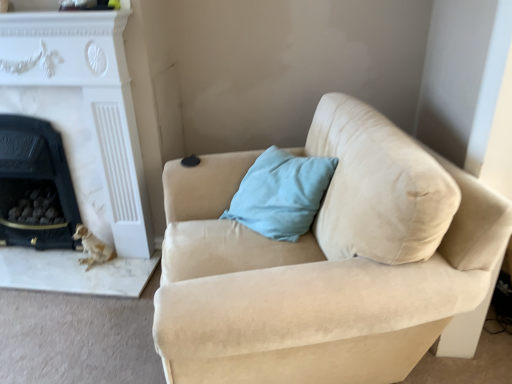
What do you see at coordinates (35, 186) in the screenshot? This screenshot has width=512, height=384. I see `black marble fireplace at left, the 2th fireplace viewed from the right` at bounding box center [35, 186].

This screenshot has height=384, width=512. I want to click on black marble fireplace at left, which appears as the 1th fireplace when viewed from the left, so click(35, 186).

From a real-world perspective, is white marble fireplace at left, marked as the second fireplace in a left-to-right arrangement, physically above beige suede couch at center?

Yes, from a real-world perspective, white marble fireplace at left, marked as the second fireplace in a left-to-right arrangement, is above beige suede couch at center.

Would you say beige suede couch at center is part of white marble fireplace at left, marked as the second fireplace in a left-to-right arrangement,'s contents?

No, beige suede couch at center is not a part of white marble fireplace at left, marked as the second fireplace in a left-to-right arrangement.

Between white marble fireplace at left, marked as the second fireplace in a left-to-right arrangement, and beige suede couch at center, which one has smaller size?

white marble fireplace at left, marked as the second fireplace in a left-to-right arrangement, is smaller.

How far apart are white marble fireplace at left, which is counted as the first fireplace, starting from the right, and beige suede couch at center?

white marble fireplace at left, which is counted as the first fireplace, starting from the right, is 34.21 inches away from beige suede couch at center.

Measure the distance between white marble fireplace at left, which is counted as the first fireplace, starting from the right, and light blue fabric pillow at upper right.

white marble fireplace at left, which is counted as the first fireplace, starting from the right, and light blue fabric pillow at upper right are 31.12 inches apart from each other.

This screenshot has width=512, height=384. In order to click on fireplace that appears above the light blue fabric pillow at upper right (from a real-world perspective) in this screenshot , I will do [81, 143].

From the picture: Visually, is white marble fireplace at left, marked as the second fireplace in a left-to-right arrangement, positioned to the left or to the right of light blue fabric pillow at upper right?

Based on their positions, white marble fireplace at left, marked as the second fireplace in a left-to-right arrangement, is located to the left of light blue fabric pillow at upper right.

Is light blue fabric pillow at upper right surrounded by white marble fireplace at left, marked as the second fireplace in a left-to-right arrangement?

No, light blue fabric pillow at upper right is located outside of white marble fireplace at left, marked as the second fireplace in a left-to-right arrangement.

From a real-world perspective, which is physically below, black marble fireplace at left, which appears as the 1th fireplace when viewed from the left, or white marble fireplace at left, marked as the second fireplace in a left-to-right arrangement?

From a 3D spatial view, black marble fireplace at left, which appears as the 1th fireplace when viewed from the left, is below.

Considering the sizes of objects black marble fireplace at left, the 2th fireplace viewed from the right, and white marble fireplace at left, marked as the second fireplace in a left-to-right arrangement, in the image provided, who is wider, black marble fireplace at left, the 2th fireplace viewed from the right, or white marble fireplace at left, marked as the second fireplace in a left-to-right arrangement,?

black marble fireplace at left, the 2th fireplace viewed from the right, is wider.

Is black marble fireplace at left, the 2th fireplace viewed from the right, in front of or behind white marble fireplace at left, which is counted as the first fireplace, starting from the right, in the image?

In the image, black marble fireplace at left, the 2th fireplace viewed from the right, appears behind white marble fireplace at left, which is counted as the first fireplace, starting from the right.

In the scene shown: Does black marble fireplace at left, which appears as the 1th fireplace when viewed from the left, turn towards white marble fireplace at left, which is counted as the first fireplace, starting from the right?

Yes.

Can you confirm if beige suede couch at center is smaller than white marble fireplace at left, marked as the second fireplace in a left-to-right arrangement?

No, beige suede couch at center is not smaller than white marble fireplace at left, marked as the second fireplace in a left-to-right arrangement.

Is beige suede couch at center aimed at white marble fireplace at left, marked as the second fireplace in a left-to-right arrangement?

Yes.

From the image's perspective, between beige suede couch at center and white marble fireplace at left, which is counted as the first fireplace, starting from the right, which one is located above?

white marble fireplace at left, which is counted as the first fireplace, starting from the right.

Considering the relative sizes of beige suede couch at center and white marble fireplace at left, marked as the second fireplace in a left-to-right arrangement, in the image provided, is beige suede couch at center thinner than white marble fireplace at left, marked as the second fireplace in a left-to-right arrangement,?

Incorrect, the width of beige suede couch at center is not less than that of white marble fireplace at left, marked as the second fireplace in a left-to-right arrangement.

Looking at this image, is light blue fabric pillow at upper right a part of beige suede couch at center?

Yes, light blue fabric pillow at upper right is a part of beige suede couch at center.

Are beige suede couch at center and light blue fabric pillow at upper right beside each other?

beige suede couch at center is not next to light blue fabric pillow at upper right, and they're not touching.

How different are the orientations of white marble fireplace at left, which is counted as the first fireplace, starting from the right, and black marble fireplace at left, the 2th fireplace viewed from the right, in degrees?

The angle between the facing direction of white marble fireplace at left, which is counted as the first fireplace, starting from the right, and the facing direction of black marble fireplace at left, the 2th fireplace viewed from the right, is 0.000122 degrees.

Is the surface of white marble fireplace at left, which is counted as the first fireplace, starting from the right, in direct contact with black marble fireplace at left, the 2th fireplace viewed from the right?

They are not placed beside each other.

From a real-world perspective, which object stands above the other?

From a 3D spatial view, white marble fireplace at left, which is counted as the first fireplace, starting from the right, is above.

From the image's perspective, who appears lower, white marble fireplace at left, which is counted as the first fireplace, starting from the right, or black marble fireplace at left, the 2th fireplace viewed from the right?

black marble fireplace at left, the 2th fireplace viewed from the right, is shown below in the image.

Are light blue fabric pillow at upper right and white marble fireplace at left, marked as the second fireplace in a left-to-right arrangement, beside each other?

There is a gap between light blue fabric pillow at upper right and white marble fireplace at left, marked as the second fireplace in a left-to-right arrangement.

From the image's perspective, does light blue fabric pillow at upper right appear lower than white marble fireplace at left, which is counted as the first fireplace, starting from the right?

Yes.

Considering the sizes of objects light blue fabric pillow at upper right and white marble fireplace at left, marked as the second fireplace in a left-to-right arrangement, in the image provided, who is bigger, light blue fabric pillow at upper right or white marble fireplace at left, marked as the second fireplace in a left-to-right arrangement,?

Bigger between the two is white marble fireplace at left, marked as the second fireplace in a left-to-right arrangement.

Is white marble fireplace at left, which is counted as the first fireplace, starting from the right, completely or partially inside light blue fabric pillow at upper right?

No, light blue fabric pillow at upper right does not contain white marble fireplace at left, which is counted as the first fireplace, starting from the right.

The height and width of the screenshot is (384, 512). I want to click on studio couch below the white marble fireplace at left, marked as the second fireplace in a left-to-right arrangement (from the image's perspective), so click(324, 263).

I want to click on pillow that appears in front of the white marble fireplace at left, marked as the second fireplace in a left-to-right arrangement, so click(281, 194).

Based on their spatial positions, is black marble fireplace at left, which appears as the 1th fireplace when viewed from the left, or white marble fireplace at left, marked as the second fireplace in a left-to-right arrangement, further from beige suede couch at center?

The object further to beige suede couch at center is black marble fireplace at left, which appears as the 1th fireplace when viewed from the left.

Considering their positions, is light blue fabric pillow at upper right positioned further to beige suede couch at center than black marble fireplace at left, which appears as the 1th fireplace when viewed from the left?

black marble fireplace at left, which appears as the 1th fireplace when viewed from the left, is further to beige suede couch at center.

Looking at the image, which one is located closer to beige suede couch at center, white marble fireplace at left, which is counted as the first fireplace, starting from the right, or light blue fabric pillow at upper right?

The object closer to beige suede couch at center is light blue fabric pillow at upper right.

Estimate the real-world distances between objects in this image. Which object is closer to black marble fireplace at left, which appears as the 1th fireplace when viewed from the left, beige suede couch at center or light blue fabric pillow at upper right?

Based on the image, light blue fabric pillow at upper right appears to be nearer to black marble fireplace at left, which appears as the 1th fireplace when viewed from the left.

Estimate the real-world distances between objects in this image. Which object is closer to light blue fabric pillow at upper right, white marble fireplace at left, which is counted as the first fireplace, starting from the right, or beige suede couch at center?

The object closer to light blue fabric pillow at upper right is beige suede couch at center.

From the image, which object appears to be nearer to light blue fabric pillow at upper right, beige suede couch at center or white marble fireplace at left, marked as the second fireplace in a left-to-right arrangement?

beige suede couch at center lies closer to light blue fabric pillow at upper right than the other object.

When comparing their distances from black marble fireplace at left, the 2th fireplace viewed from the right, does white marble fireplace at left, which is counted as the first fireplace, starting from the right, or beige suede couch at center seem closer?

Based on the image, white marble fireplace at left, which is counted as the first fireplace, starting from the right, appears to be nearer to black marble fireplace at left, the 2th fireplace viewed from the right.

From the image, which object appears to be nearer to white marble fireplace at left, marked as the second fireplace in a left-to-right arrangement, light blue fabric pillow at upper right or beige suede couch at center?

light blue fabric pillow at upper right is closer to white marble fireplace at left, marked as the second fireplace in a left-to-right arrangement.

I want to click on fireplace between black marble fireplace at left, the 2th fireplace viewed from the right, and light blue fabric pillow at upper right, in the horizontal direction, so click(x=81, y=143).

Image resolution: width=512 pixels, height=384 pixels. Find the location of `pillow situated between white marble fireplace at left, which is counted as the first fireplace, starting from the right, and beige suede couch at center from left to right`. pillow situated between white marble fireplace at left, which is counted as the first fireplace, starting from the right, and beige suede couch at center from left to right is located at coordinates (281, 194).

The width and height of the screenshot is (512, 384). I want to click on pillow situated between black marble fireplace at left, which appears as the 1th fireplace when viewed from the left, and beige suede couch at center from left to right, so click(x=281, y=194).

The width and height of the screenshot is (512, 384). Identify the location of fireplace between black marble fireplace at left, the 2th fireplace viewed from the right, and beige suede couch at center. (81, 143).